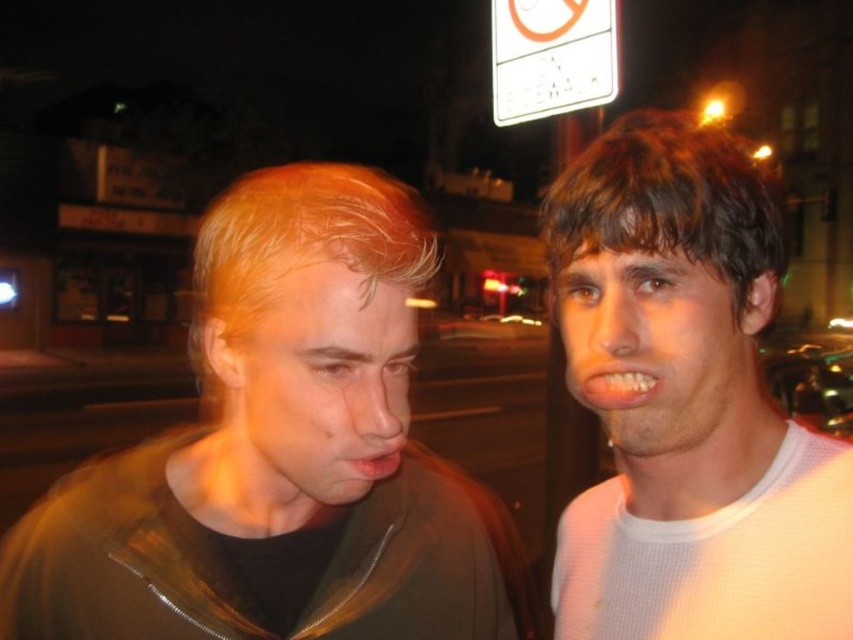
Question: Can you confirm if matte brown jacket at left is positioned above light brown hair at right?

Choices:
 (A) no
 (B) yes

Answer: (A)

Question: Can you confirm if light brown hair at right is thinner than white plastic sign at upper center?

Choices:
 (A) yes
 (B) no

Answer: (A)

Question: Which of the following is the closest to the observer?

Choices:
 (A) (556, 17)
 (B) (601, 192)
 (C) (259, 360)

Answer: (C)

Question: Which object appears farthest from the camera in this image?

Choices:
 (A) white plastic sign at upper center
 (B) matte brown jacket at left
 (C) light brown hair at right

Answer: (A)

Question: Does light brown hair at right appear on the left side of white plastic sign at upper center?

Choices:
 (A) yes
 (B) no

Answer: (A)

Question: Among these objects, which one is nearest to the camera?

Choices:
 (A) light brown hair at right
 (B) white plastic sign at upper center
 (C) matte brown jacket at left

Answer: (A)